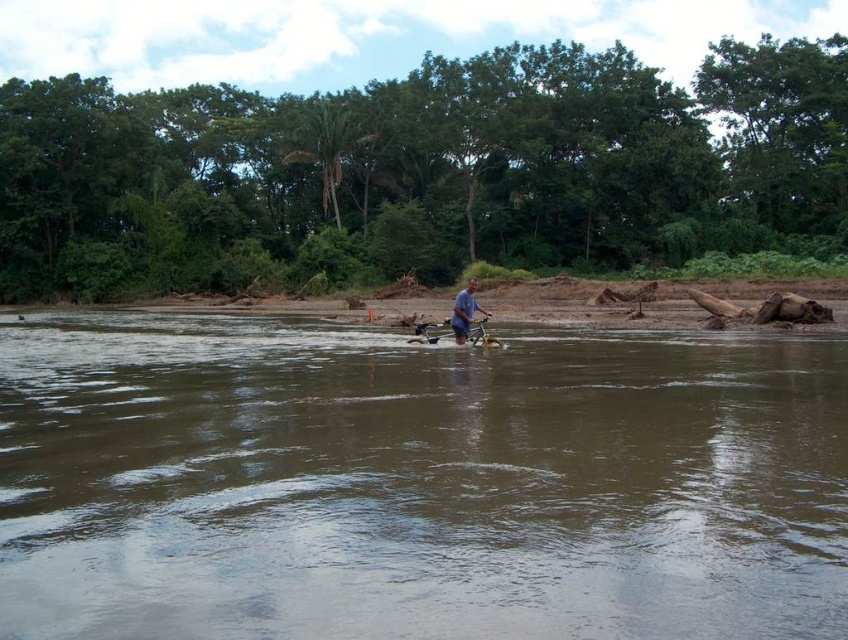
You are a hiker trying to cross the river and need to place a marker at the point with coordinates point (x=416, y=483). According to the scene, where should this marker be placed?

The point (x=416, y=483) is on the brown muddy water at center, so the marker should be placed there.

You are standing at the point labeled point (154, 509) and want to walk to the point labeled point (450, 308). Given that the water depth increases as you move away from the viewer, will the water be deeper or shallower at your destination?

The water will be deeper at your destination because point (450, 308) is farther from the viewer than point (154, 509), and water depth increases with distance from the viewer.